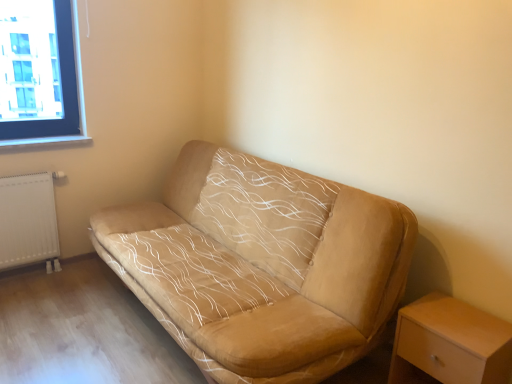
Question: From their relative heights in the image, would you say light wood/wooden nightstand at lower right is taller or shorter than suede beige couch at center?

Choices:
 (A) tall
 (B) short

Answer: (B)

Question: Considering the positions of light wood/wooden nightstand at lower right and suede beige couch at center in the image, is light wood/wooden nightstand at lower right wider or thinner than suede beige couch at center?

Choices:
 (A) thin
 (B) wide

Answer: (A)

Question: Estimate the real-world distances between objects in this image. Which object is closer to the light wood/wooden nightstand at lower right?

Choices:
 (A) suede beige couch at center
 (B) white matte radiator at lower left

Answer: (A)

Question: Which of these objects is positioned farthest from the light wood/wooden nightstand at lower right?

Choices:
 (A) suede beige couch at center
 (B) white matte radiator at lower left

Answer: (B)